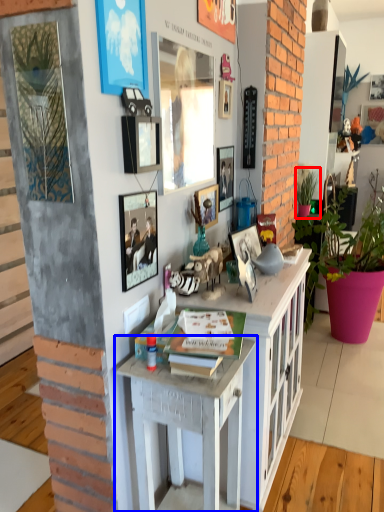
Question: Among these objects, which one is farthest to the camera, houseplant (highlighted by a red box) or desk (highlighted by a blue box)?

Choices:
 (A) houseplant
 (B) desk

Answer: (A)